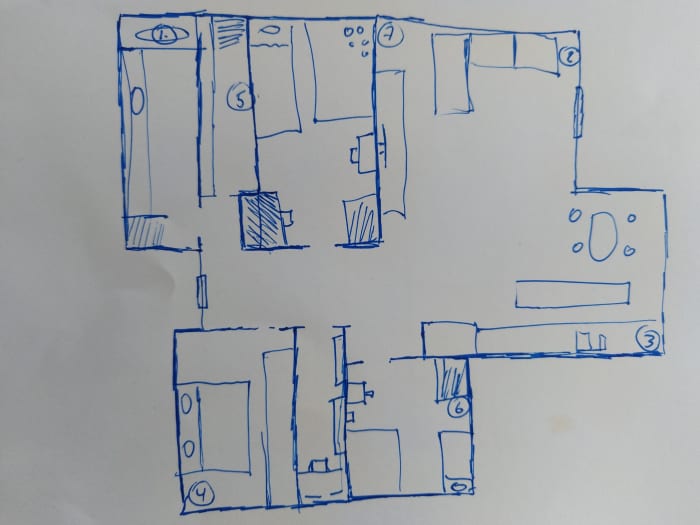
Find the location of a particular element. Image resolution: width=700 pixels, height=525 pixels. beds is located at coordinates (274, 71), (462, 458), (211, 425).